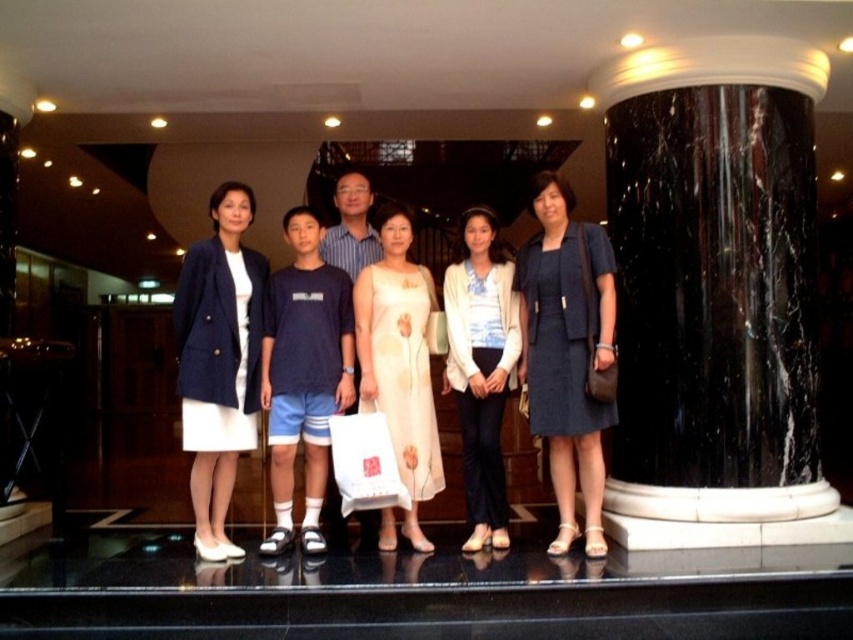
Based on the photo, you are standing in a hotel lobby and want to take a photo of the matte blue dress at center. You have a camera with a maximum focus range of 4 meters. Can you capture a clear photo without moving closer?

The distance between the matte blue dress at center and the camera is 4.13 meters, which exceeds the camera maximum focus range of 4 meters. Therefore, you cannot capture a clear photo without moving closer.